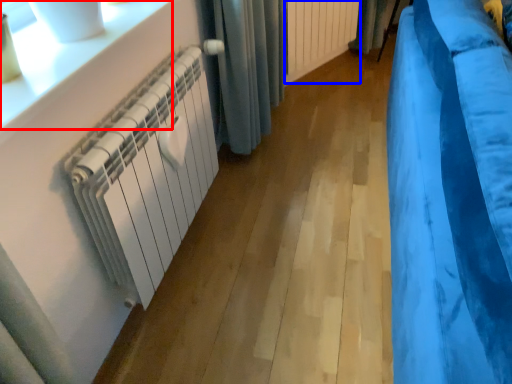
Question: Which of the following is the farthest to the observer, window sill (highlighted by a red box) or radiator (highlighted by a blue box)?

Choices:
 (A) window sill
 (B) radiator

Answer: (B)